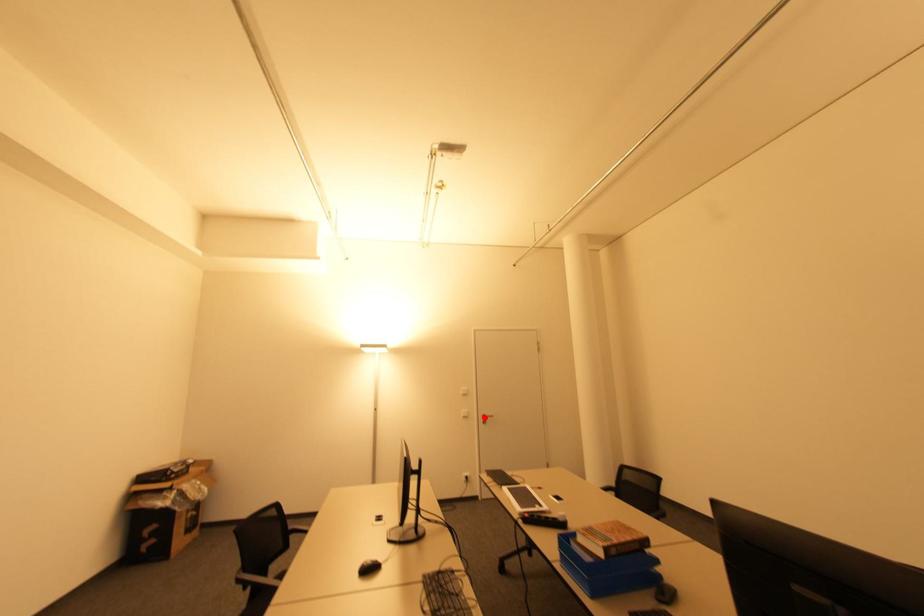
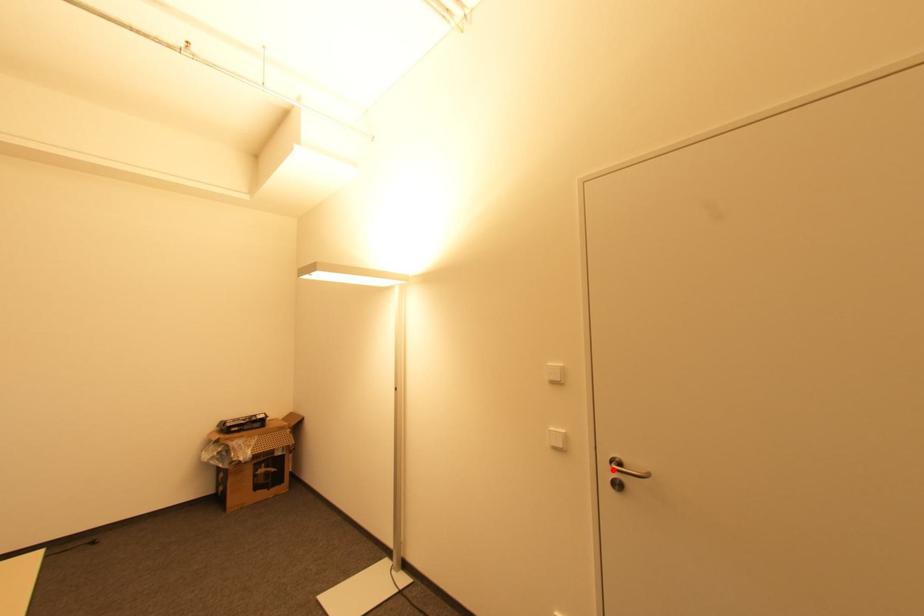
I am providing you with two images of the same scene from different viewpoints. A red point is marked on the first image and another point is marked on the second image. Are the points marked in image1 and image2 representing the same 3D position?

Yes